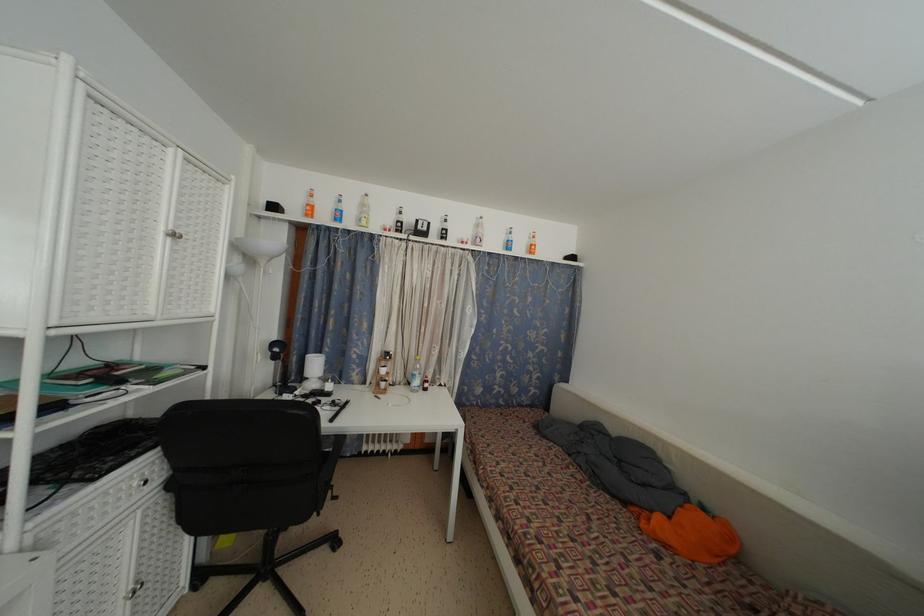
Find the location of a particular element. light blue bottle is located at coordinates (337, 209).